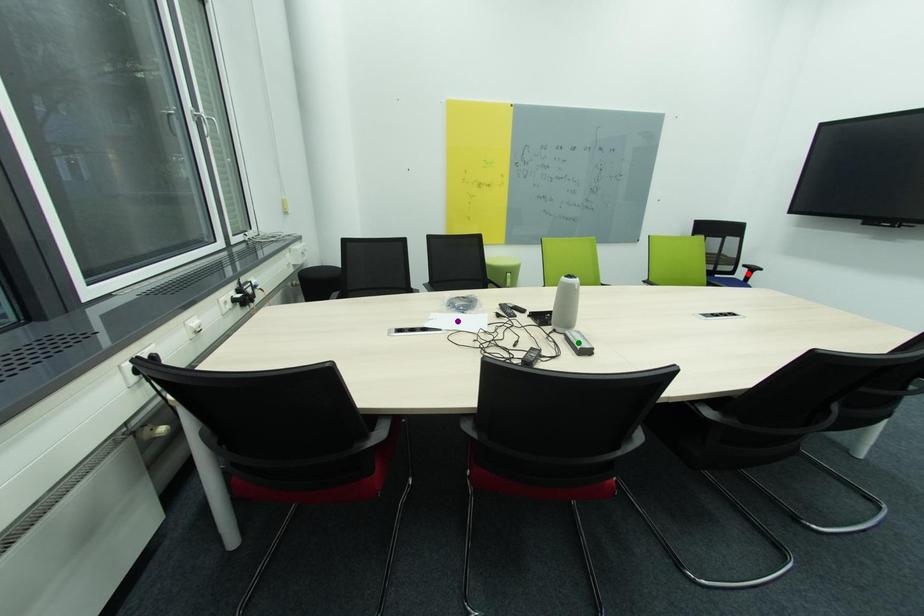
Looking at this image, order these from farthest to nearest:
purple point | red point | green point

red point < purple point < green point